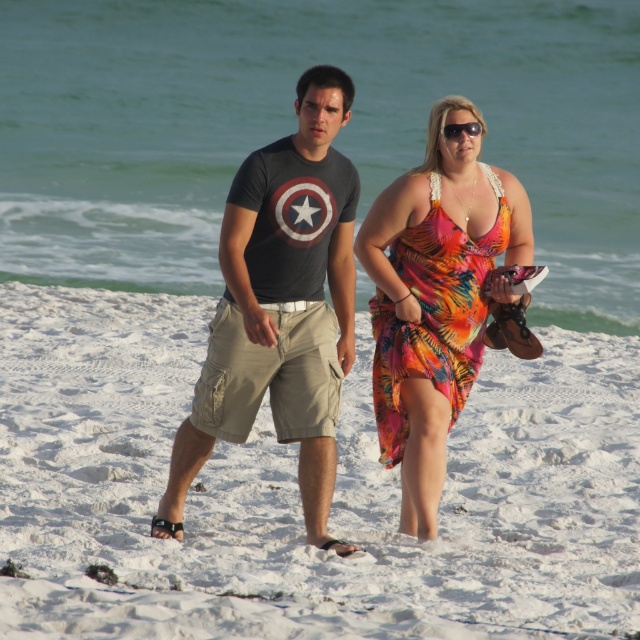
You are standing on the beach and see two points marked in the scene. Which point, point [227,273] or point [470,132], is closer to you?

Point [227,273] is closer to the viewer than point [470,132].